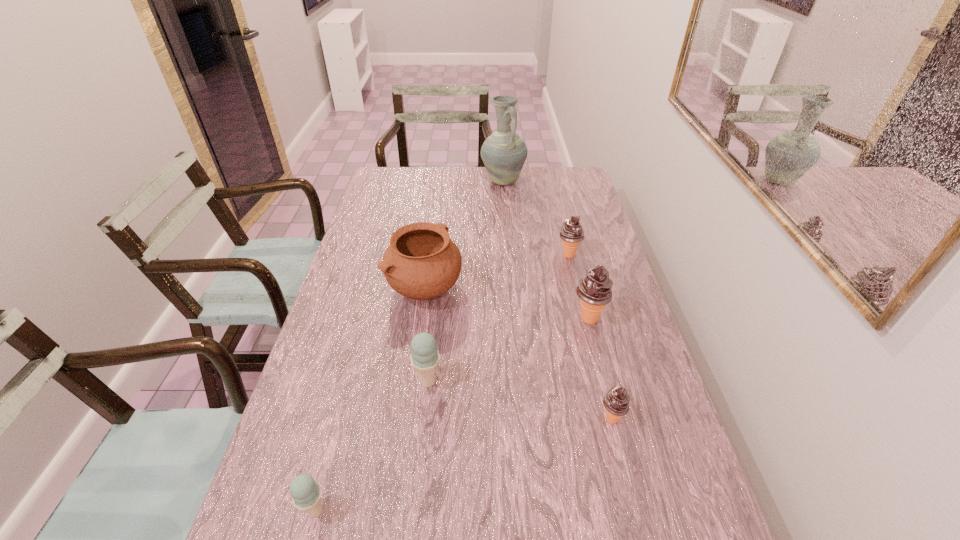
Where is `vacant area between the second nearest object and the terracotta pottery`? The image size is (960, 540). vacant area between the second nearest object and the terracotta pottery is located at coordinates (518, 354).

What are the coordinates of `empty space that is in between the farther blue ice cream and the second nearest object` in the screenshot? It's located at (519, 400).

At what (x,y) coordinates should I click in order to perform the action: click on blank region between the nearest ice cream and the fourth nearest ice cream. Please return your answer as a coordinate pair (x, y). The width and height of the screenshot is (960, 540). Looking at the image, I should click on pos(452,415).

Find the location of a particular element. vacant space that's between the pitcher and the bigger blue ice cream is located at coordinates (466, 281).

Identify the location of the closest object relative to the tallest object. This screenshot has width=960, height=540. (571, 233).

The image size is (960, 540). What are the coordinates of `object that is the closest to the pottery` in the screenshot? It's located at (425, 357).

Locate an element on the screen. This screenshot has height=540, width=960. ice cream that stands as the closest to the biggest chocolate icecream is located at coordinates (571, 233).

Where is `ice cream that is the second closest to the sixth nearest object`? This screenshot has height=540, width=960. ice cream that is the second closest to the sixth nearest object is located at coordinates (616, 401).

Locate which chocolate icecream ranks third in proximity to the third nearest object. Please provide its 2D coordinates. Your answer should be formatted as a tuple, i.e. [(x, y)], where the tuple contains the x and y coordinates of a point satisfying the conditions above.

[(571, 233)]

At what (x,y) coordinates should I click in order to perform the action: click on the closest chocolate icecream to the terracotta pottery. Please return your answer as a coordinate pair (x, y). Image resolution: width=960 pixels, height=540 pixels. Looking at the image, I should click on (571, 233).